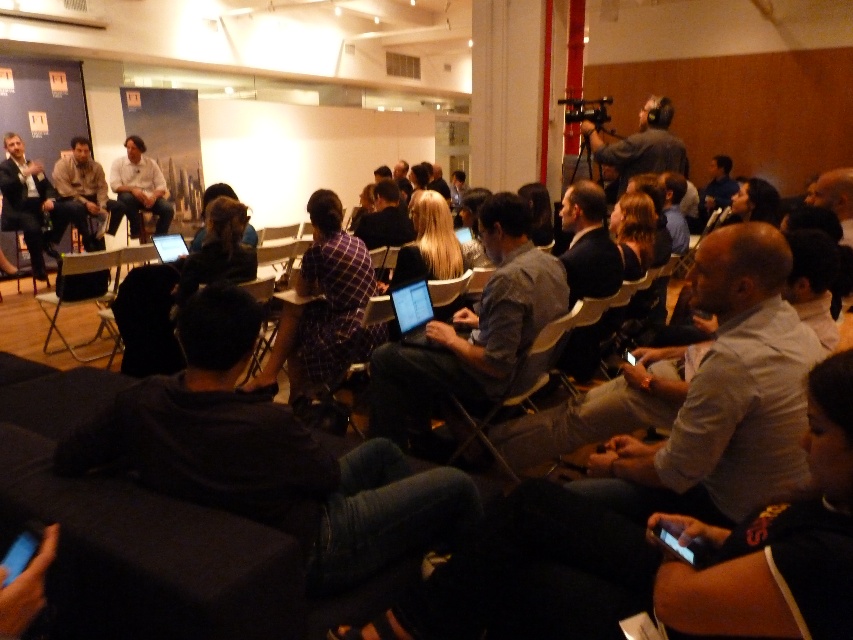
In the scene shown: You are sitting in the front row of the conference room and want to quickly grab the black plastic chair at left to adjust your seating. Considering your current position, can you reach it without moving more than 3 meters?

The black plastic chair at left is 4.06 meters away from viewer, so you cannot reach it without moving more than 3 meters.

Consider the image. You are standing at point (97,164) and want to walk to the stage. Is the point (323,280) in your path?

Yes, point (323,280) is in front of point (97,164), so it is in your path to the stage.